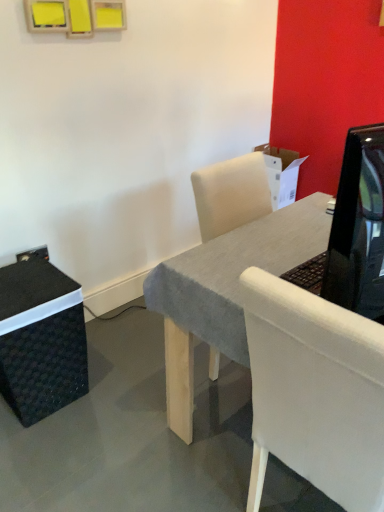
Find the location of a particular element. This screenshot has height=512, width=384. free point above black woven box at lower left (from a real-world perspective) is located at coordinates (24, 282).